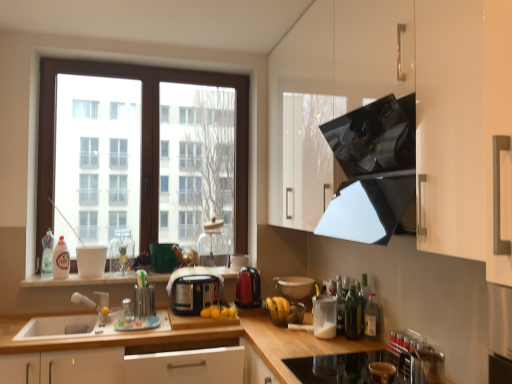
The width and height of the screenshot is (512, 384). I want to click on free location in front of translucent glass bottle at right, which ranks as the 5th bottle in left-to-right order, so click(373, 347).